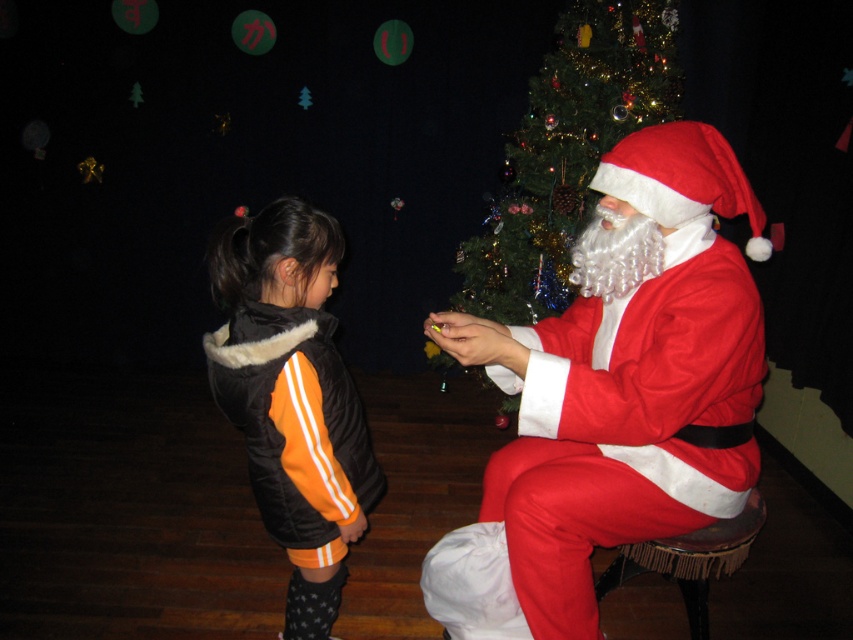
Based on the photo, you are a photographer at this event and want to take a photo of the velvet red santa at right and the green shiny christmas tree at upper center. Based on their positions, which object should be placed higher in the frame to ensure both are visible?

The green shiny christmas tree at upper center should be placed higher in the frame since the velvet red santa at right is located below it.

You are a tailor measuring fabrics for a new coat. You need to decide between using fabric for the black fleece jacket at left or the green shiny christmas tree at upper center. Which object requires a larger piece of fabric based on their widths?

The green shiny christmas tree at upper center requires a larger piece of fabric because its width is greater than the black fleece jacket at left.